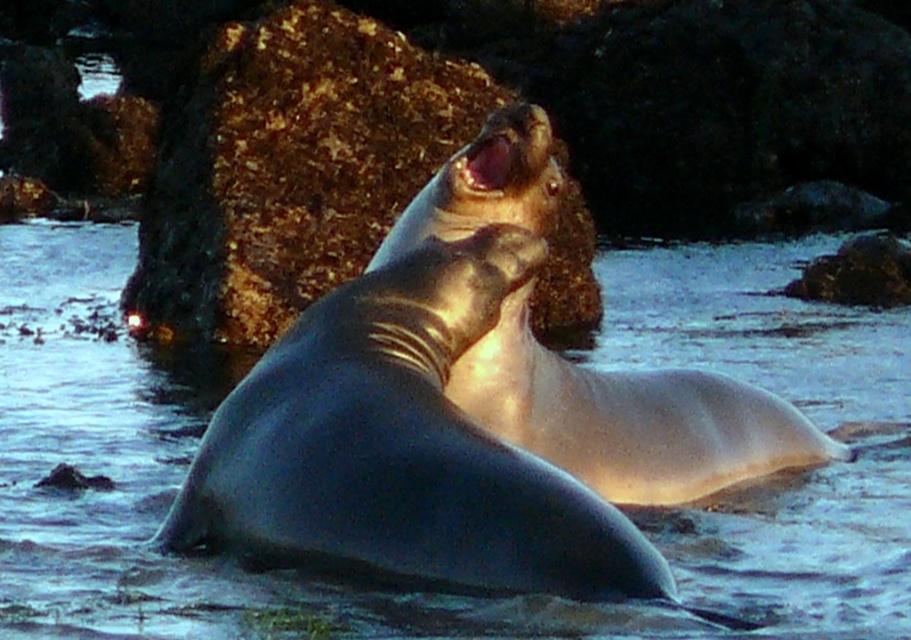
Question: Is rusty rock at center below shiny gray seal at center?

Choices:
 (A) yes
 (B) no

Answer: (B)

Question: Among these points, which one is nearest to the camera?

Choices:
 (A) (768, 387)
 (B) (166, 125)

Answer: (A)

Question: Does clear water at seal left appear under shiny gray seal at center?

Choices:
 (A) no
 (B) yes

Answer: (B)

Question: Does clear water at seal left come behind rusty rock at center?

Choices:
 (A) yes
 (B) no

Answer: (B)

Question: Which is nearer to the clear water at seal left?

Choices:
 (A) rusty rock at center
 (B) shiny gray seal at center

Answer: (B)

Question: Considering the real-world distances, which object is closest to the clear water at seal left?

Choices:
 (A) rusty rock at center
 (B) shiny gray seal at center

Answer: (B)